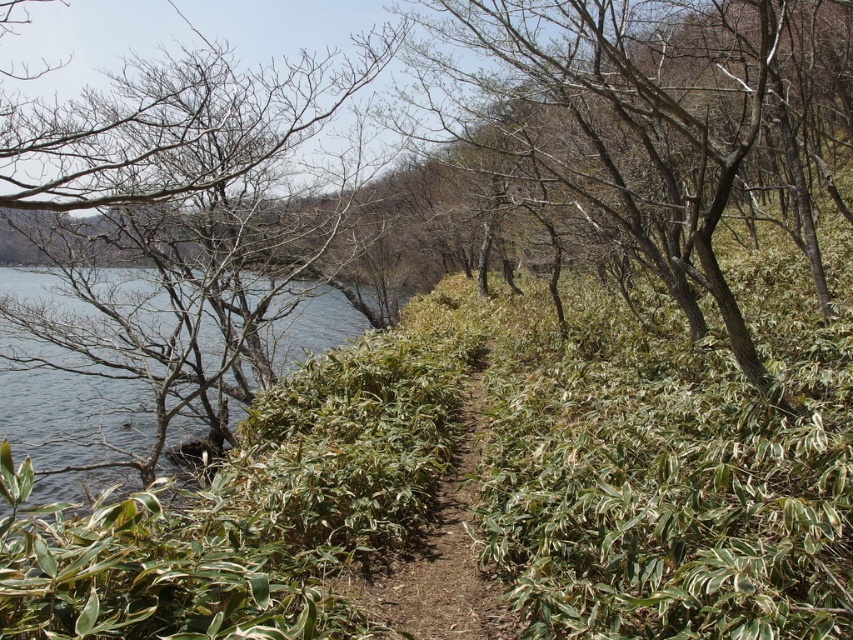
You are standing at the center of the brown dirt path at center and want to walk towards the green leafy shrub at center. Is the shrub located to your left or right side?

The green leafy shrub at center is positioned on the right side of brown dirt path at center, so it is to your right side.

You are standing at the point marked as point (x=171, y=248) in the image. What can you see to your immediate left?

To your immediate left at point (x=171, y=248), there are bare branches.

You are standing on the narrow dirt path and want to walk towards the body of water on the left. Which direction should you walk to avoid the green leafy shrub at center and the green leafy shrubs at left?

The green leafy shrub at center is above the green leafy shrubs at left, so to avoid both, you should walk to the right side of the path where there is less vegetation blocking your path.